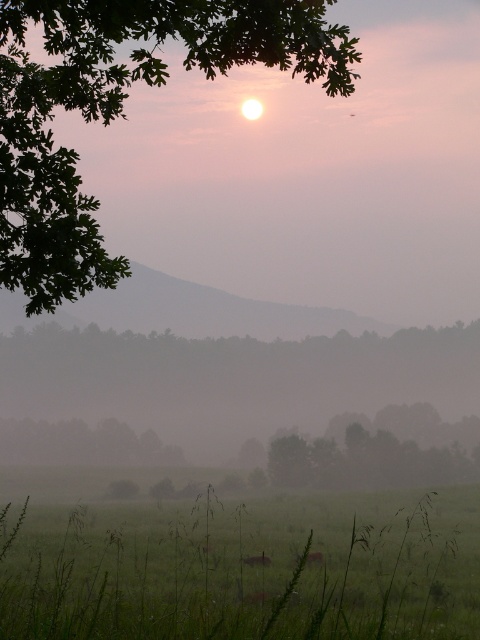
From the picture: You are standing in the rural landscape and want to walk towards the point marked at coordinates (302, 534). How far will you have to walk to reach that point?

The point at coordinates (302, 534) is 54.31 meters away from the viewer, so you will have to walk 54.31 meters to reach it.

You are standing in the rural landscape and want to take a photo of the brown furry rabbit at center without the green leafy tree at upper left blocking the view. Can you do this by moving closer to the rabbit?

The green leafy tree at upper left is much taller than the brown furry rabbit at center, so moving closer to the rabbit might still leave the tree visible in the background unless you position yourself in a way that the tree is out of the camera frame. However, since the tree is taller, it might still block the view depending on the angle and distance.

You are standing at the center of the field in the image. Which direction should you walk to reach the green leafy tree at upper left marked by point (x=120, y=109)?

The green leafy tree at upper left marked by point (x=120, y=109) is located at the upper left of the image, so you should walk towards the upper left direction to reach it.